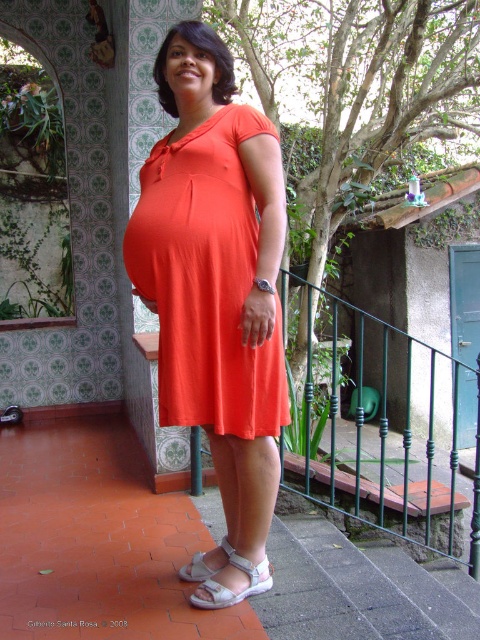
You are a photographer trying to capture the orange matte dress at center. You need to position your camera at point A which is at coordinate (205, 280). Is the orange matte dress at center located exactly at point A?

Yes, the orange matte dress at center is located exactly at point A since the coordinates provided match the location of the orange matte dress at center.

You are a photographer trying to capture a photo of the woman standing on the patio. You notice the green metal balustrade at center and the white fabric sandal at lower center. Which object is closer to the camera, and why?

The green metal balustrade at center is closer to the camera because it is further to the viewer than the white fabric sandal at lower center, meaning it appears in front of the sandal in the image.